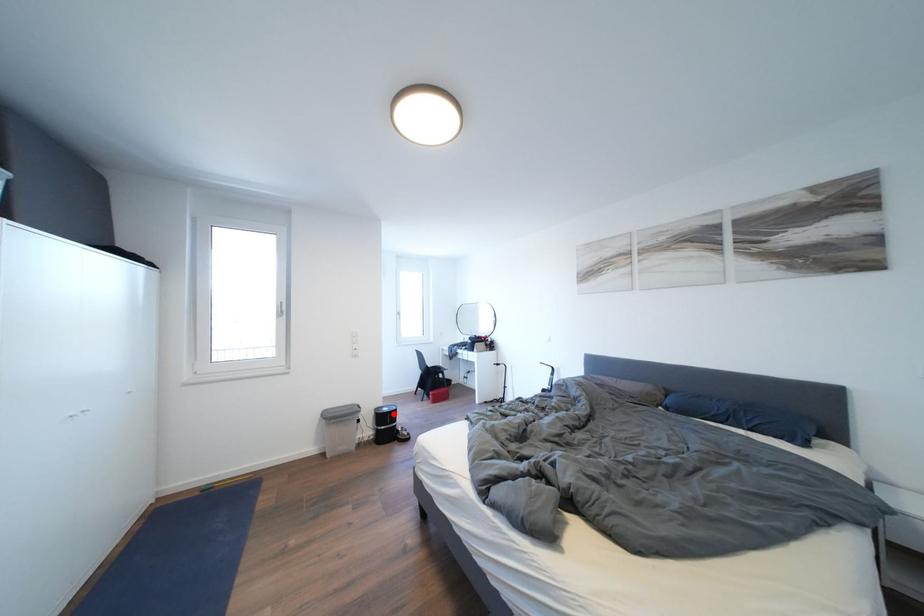
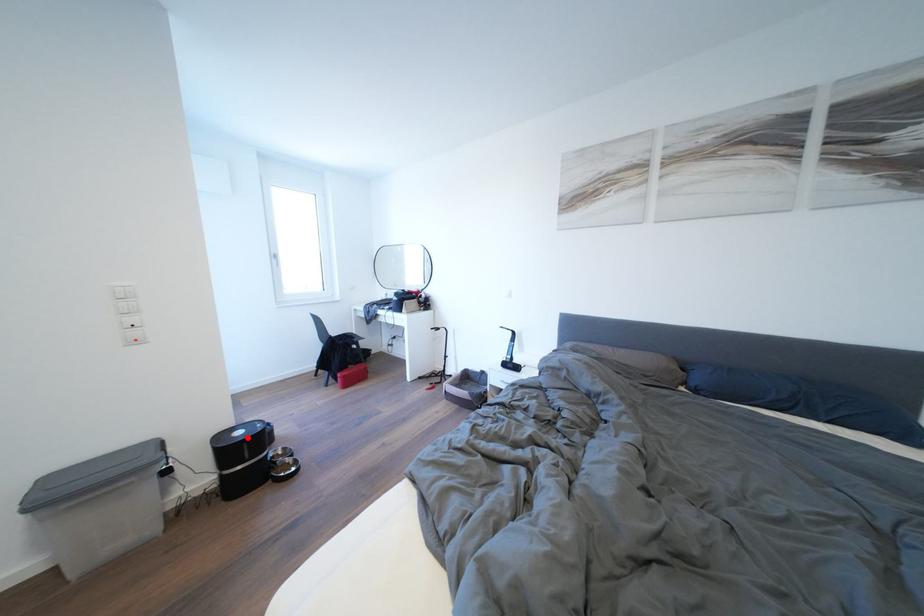
I am providing you with two images of the same scene from different viewpoints. A red point is marked on the first image and another point is marked on the second image. Are the points marked in image1 and image2 representing the same 3D position?

Yes